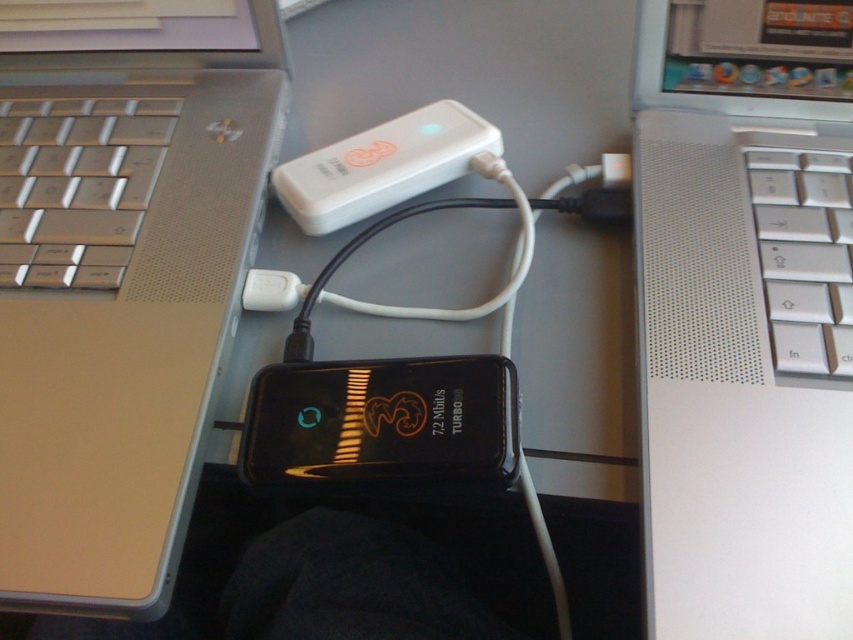
Consider the image. Can you confirm if silver metallic laptop at center is bigger than white matte usb device at center?

Yes, silver metallic laptop at center is bigger than white matte usb device at center.

Consider the image. Who is shorter, silver metallic laptop at center or white matte usb device at center?

With less height is white matte usb device at center.

The width and height of the screenshot is (853, 640). Describe the element at coordinates (120, 276) in the screenshot. I see `silver metallic laptop at center` at that location.

Identify the location of silver metallic laptop at center. (120, 276).

Is silver metallic laptop at center-right wider than silver metallic keyboard at right?

Yes.

You are a GUI agent. You are given a task and a screenshot of the screen. Output one action in this format:
    pyautogui.click(x=<x>, y=<y>)
    Task: Click on the silver metallic laptop at center-right
    
    Given the screenshot: What is the action you would take?
    pyautogui.click(x=744, y=316)

Does silver metallic keyboard at right have a lesser width compared to white matte usb device at center?

Correct, silver metallic keyboard at right's width is less than white matte usb device at center's.

Measure the distance between silver metallic keyboard at right and white matte usb device at center.

The distance of silver metallic keyboard at right from white matte usb device at center is 8.92 inches.

The height and width of the screenshot is (640, 853). In order to click on silver metallic keyboard at right in this screenshot , I will do `click(805, 257)`.